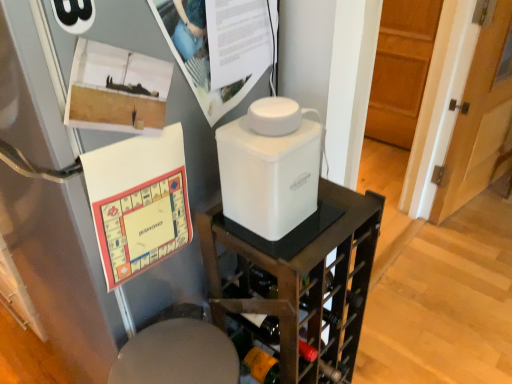
Question: Visually, is matte paper poster at upper center positioned to the left or to the right of wooden door at right?

Choices:
 (A) left
 (B) right

Answer: (A)

Question: Is matte paper poster at upper center taller or shorter than wooden door at right?

Choices:
 (A) tall
 (B) short

Answer: (B)

Question: Which is nearer to the wooden door at right?

Choices:
 (A) white plastic container at center
 (B) matte paper poster at upper center
 (C) white plastic container at center

Answer: (A)

Question: Based on their relative distances, which object is nearer to the white plastic container at center?

Choices:
 (A) wooden door at right
 (B) white plastic container at center
 (C) matte paper poster at upper center

Answer: (B)